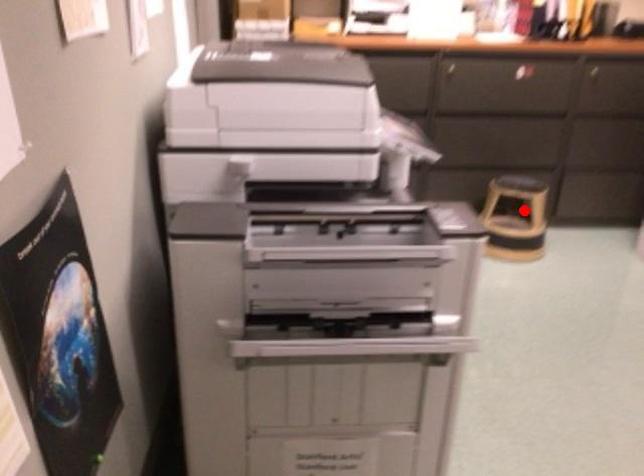
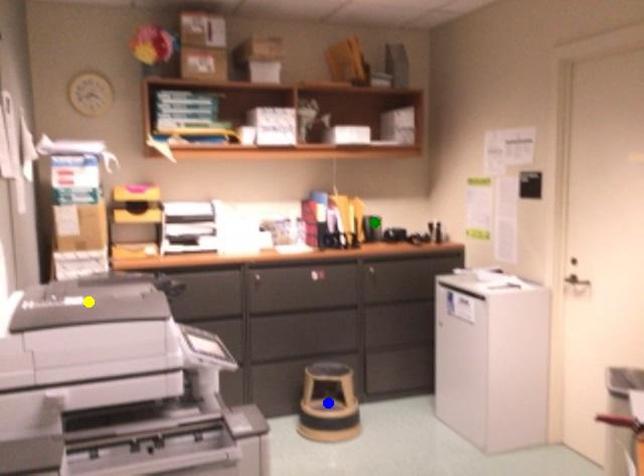
Question: I am providing you with two images of the same scene from different viewpoints. A red point is marked on the first image. You are given multiple points on the second image. In image 2, which mark is for the same physical point as the one in image 1?

Choices:
 (A) yellow point
 (B) green point
 (C) blue point

Answer: (C)